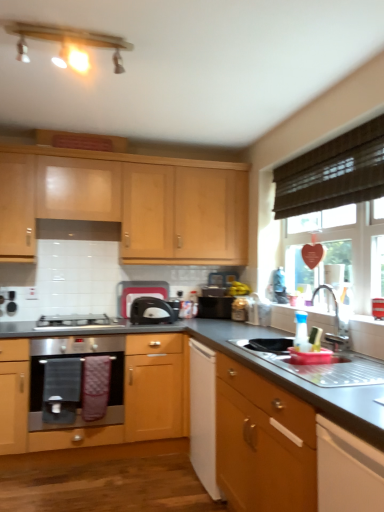
Question: From a real-world perspective, is matte wood light fixture at upper center positioned above or below light wood cabinet at upper center, the 1th cabinetry viewed from the left?

Choices:
 (A) below
 (B) above

Answer: (B)

Question: Relative to light wood cabinet at upper center, the 2th cabinetry viewed from the right, is matte wood light fixture at upper center in front or behind?

Choices:
 (A) front
 (B) behind

Answer: (A)

Question: Considering the real-world distances, which object is closest to the stainless steel oven at lower left?

Choices:
 (A) stainless steel sink at lower right
 (B) matte wood light fixture at upper center
 (C) yellow matte bananas at center
 (D) silver metallic faucet at sink right
 (E) black plastic toaster at center, placed as the 1th appliance when sorted from right to left

Answer: (E)

Question: Which object is the closest to the stainless steel oven at lower left?

Choices:
 (A) black fabric screen door at lower left
 (B) smooth gray countertop at center
 (C) light wood cabinet at upper center, the 2th cabinetry viewed from the right
 (D) yellow matte bananas at center
 (E) wooden cabinet at lower right, the second cabinetry in the back-to-front sequence

Answer: (A)